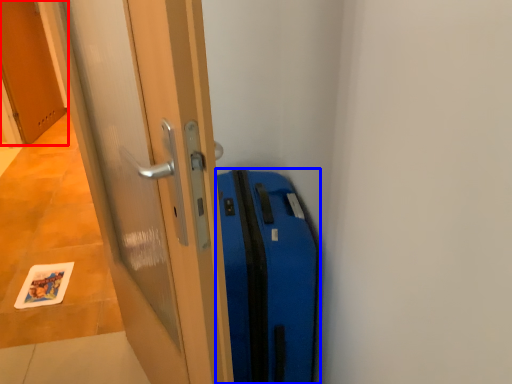
Question: Which object is closer to the camera taking this photo, door (highlighted by a red box) or suitcase (highlighted by a blue box)?

Choices:
 (A) door
 (B) suitcase

Answer: (B)